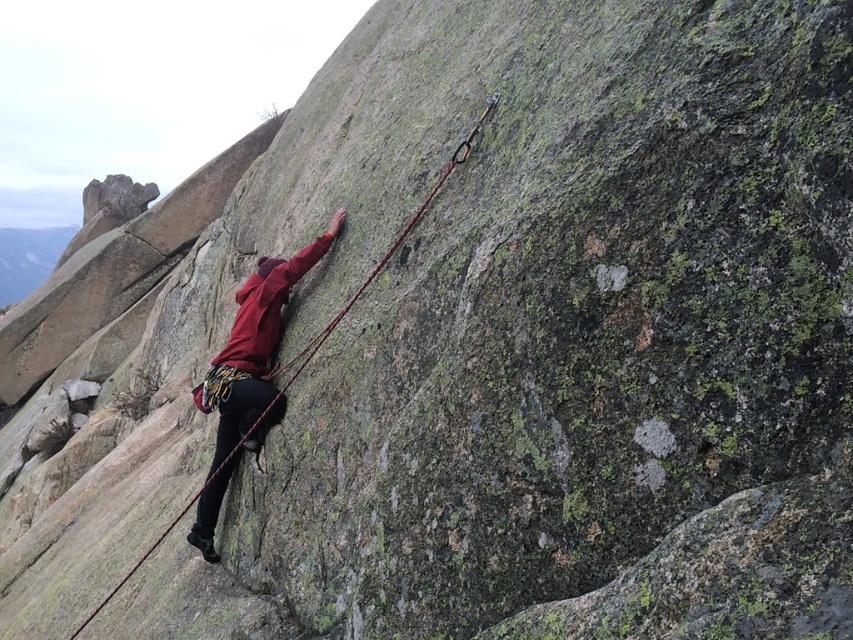
Question: From the image, what is the correct spatial relationship of matte red jacket at center in relation to red nylon rope at center?

Choices:
 (A) right
 (B) left

Answer: (A)

Question: Does matte red jacket at center have a greater width compared to red nylon rope at center?

Choices:
 (A) yes
 (B) no

Answer: (B)

Question: Which point appears closest to the camera in this image?

Choices:
 (A) (140, 560)
 (B) (277, 292)

Answer: (B)

Question: Which point is closer to the camera?

Choices:
 (A) (207, 529)
 (B) (428, 195)

Answer: (B)

Question: Can you confirm if matte red jacket at center is positioned below red nylon rope at center?

Choices:
 (A) yes
 (B) no

Answer: (B)

Question: Which object is closer to the camera taking this photo?

Choices:
 (A) matte red jacket at center
 (B) red nylon rope at center

Answer: (B)